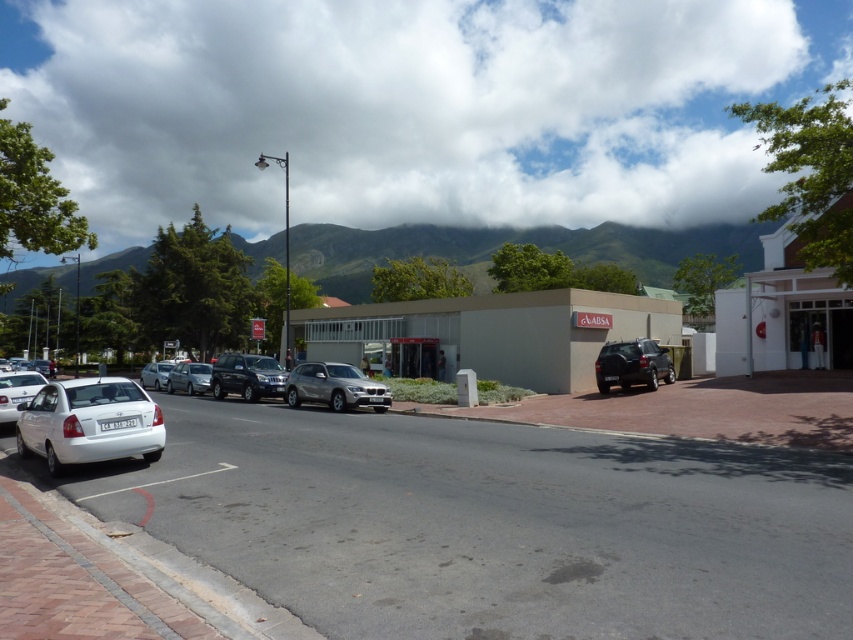
Question: Can you confirm if satin black suv at center is smaller than matte silver sedan at center-left?

Choices:
 (A) no
 (B) yes

Answer: (B)

Question: Which object is the closest to the satin silver suv at center?

Choices:
 (A) matte silver sedan at center-left
 (B) satin silver sedan at center
 (C) white glossy sedan at left

Answer: (C)

Question: Which of these objects is positioned farthest from the satin silver sedan at center?

Choices:
 (A) satin black suv at center
 (B) smooth asphalt parking lot at center
 (C) white matte sedan at lower left
 (D) white glossy sedan at left

Answer: (B)

Question: Among these objects, which one is nearest to the camera?

Choices:
 (A) satin silver suv at center
 (B) smooth asphalt parking lot at center

Answer: (B)

Question: Is satin silver suv at center positioned behind satin silver sedan at center?

Choices:
 (A) yes
 (B) no

Answer: (B)

Question: Is green grassy mountain at upper center bigger than matte silver sedan at center-left?

Choices:
 (A) yes
 (B) no

Answer: (A)